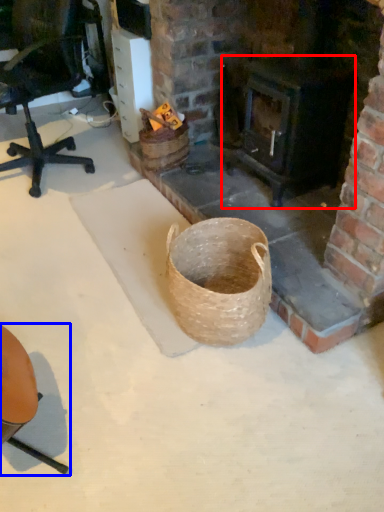
Question: Among these objects, which one is nearest to the camera, stove (highlighted by a red box) or chair (highlighted by a blue box)?

Choices:
 (A) stove
 (B) chair

Answer: (B)